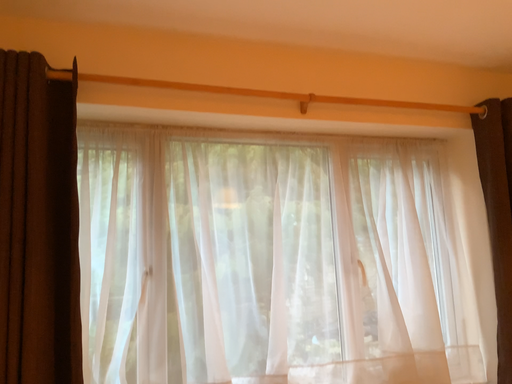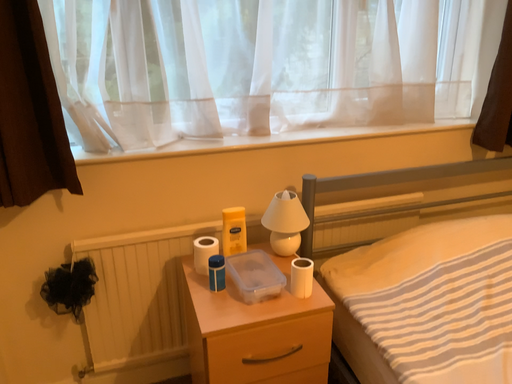
Question: How did the camera likely rotate when shooting the video?

Choices:
 (A) rotated upward
 (B) rotated downward

Answer: (B)